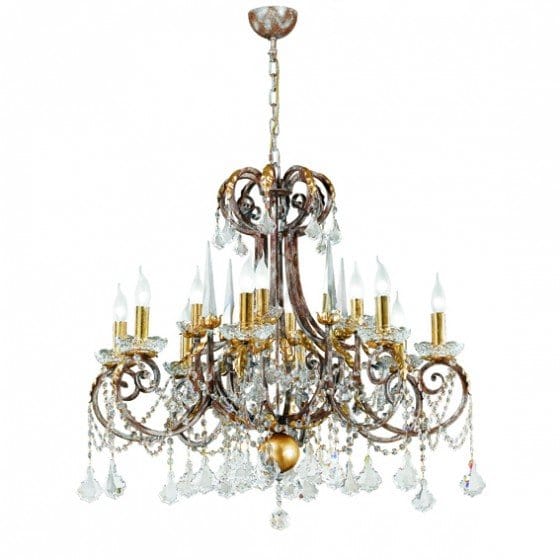
The width and height of the screenshot is (560, 560). I want to click on crystal ball, so click(x=279, y=522).